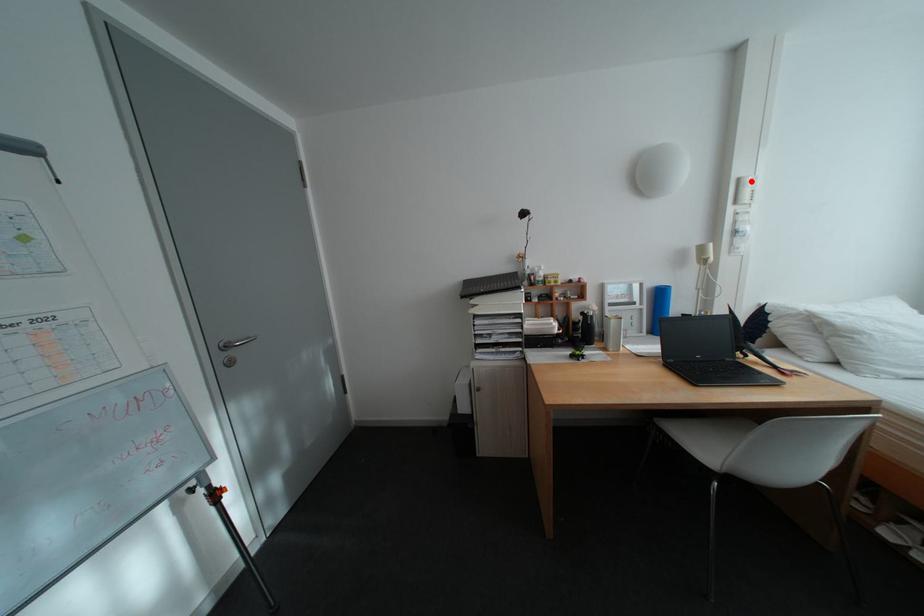
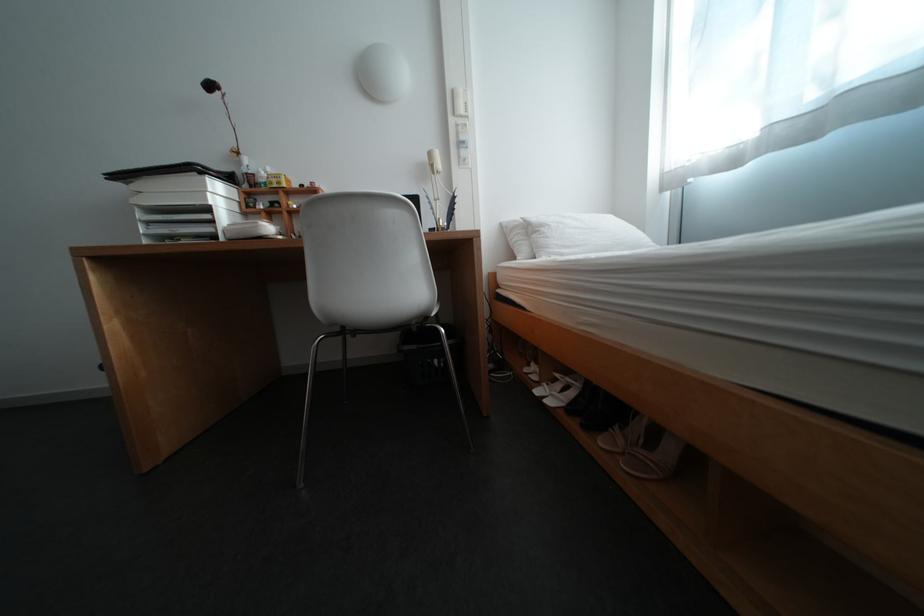
In the second image, find the point that corresponds to the highlighted location in the first image.

(466, 92)